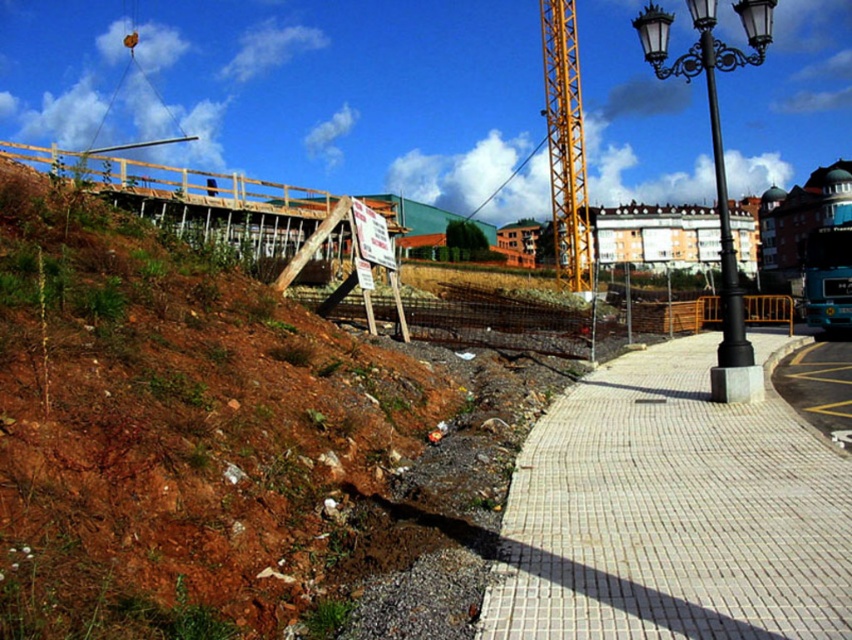
You are a delivery person with a heavy cart that can only move on stable surfaces. You need to go from the construction site to the sidewalk. Which path should you choose between the brown dirt at left and the white brick pavement at lower right?

You should choose the white brick pavement at lower right because the brown dirt at left is larger in size, which might indicate it is less stable for the heavy cart.

You are a delivery drone with a wingspan of 1.5 meters. You need to fly from the brown dirt at left to the yellow metallic crane at center. Is there enough space between them for your drone to pass safely?

The distance between the brown dirt at left and the yellow metallic crane at center is 41.47 meters, so yes, the drone can safely pass between them since the space is much wider than the drone wingspan.

Based on the photo, you are a delivery person with a cart that is 2 meters wide. You need to move from the brown dirt at left to the white brick pavement at lower right. Is there enough space for your cart to pass between them?

The distance between the brown dirt at left and the white brick pavement at lower right is 3.74 meters. Since your cart is 2 meters wide, there is sufficient space for it to pass through.